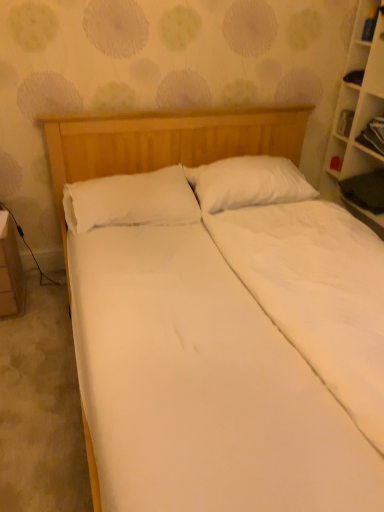
Question: Which direction should I rotate to look at white soft pillow at center, which appears as the 1th pillow when viewed from the right?

Choices:
 (A) left
 (B) right

Answer: (B)

Question: Could wooden cabinet at right be considered to be inside white soft pillow at center, the 2th pillow from the right?

Choices:
 (A) yes
 (B) no

Answer: (B)

Question: Does white soft pillow at center, marked as the first pillow in a left-to-right arrangement, have a larger size compared to wooden cabinet at right?

Choices:
 (A) yes
 (B) no

Answer: (A)

Question: Is white soft pillow at center, the 2th pillow from the right, to the left of wooden cabinet at right from the viewer's perspective?

Choices:
 (A) yes
 (B) no

Answer: (A)

Question: From the image's perspective, is white soft pillow at center, the 2th pillow from the right, on wooden cabinet at right?

Choices:
 (A) yes
 (B) no

Answer: (B)

Question: Is white soft pillow at center, marked as the first pillow in a left-to-right arrangement, outside of wooden cabinet at right?

Choices:
 (A) no
 (B) yes

Answer: (B)

Question: Could you tell me if white soft pillow at center, the 2th pillow from the right, is facing wooden cabinet at right?

Choices:
 (A) yes
 (B) no

Answer: (B)

Question: Is white glossy table at lower left completely or partially outside of white wooden bookcase at right?

Choices:
 (A) yes
 (B) no

Answer: (A)

Question: Is white glossy table at lower left surrounding white wooden bookcase at right?

Choices:
 (A) no
 (B) yes

Answer: (A)

Question: Is white glossy table at lower left in front of white wooden bookcase at right?

Choices:
 (A) no
 (B) yes

Answer: (A)

Question: Does white glossy table at lower left turn towards white wooden bookcase at right?

Choices:
 (A) no
 (B) yes

Answer: (A)

Question: Is white glossy table at lower left further to camera compared to white wooden bookcase at right?

Choices:
 (A) no
 (B) yes

Answer: (B)

Question: Considering the relative sizes of white glossy table at lower left and white wooden bookcase at right in the image provided, is white glossy table at lower left smaller than white wooden bookcase at right?

Choices:
 (A) yes
 (B) no

Answer: (A)

Question: Can you confirm if white wooden bookcase at right is smaller than wooden cabinet at right?

Choices:
 (A) no
 (B) yes

Answer: (A)